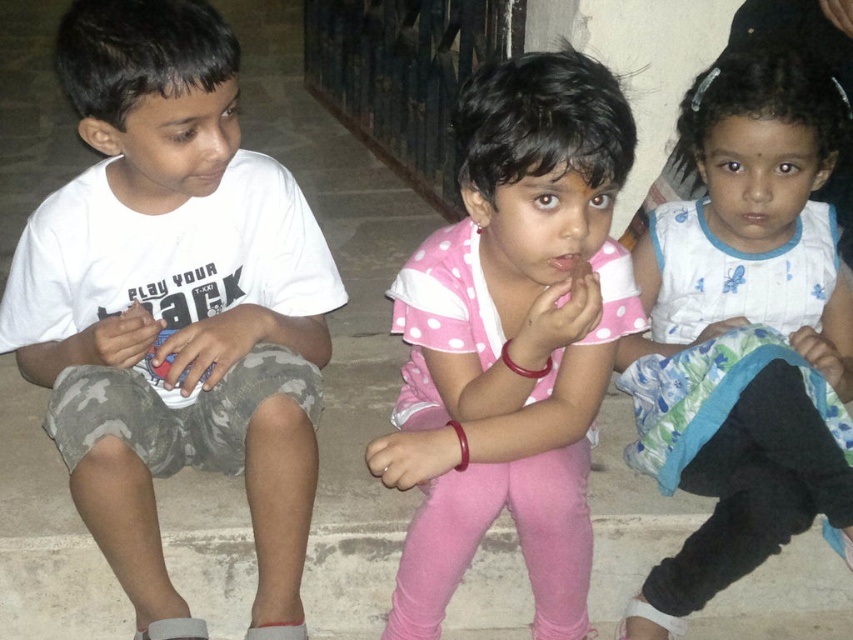
In the scene where three children are sitting on a stone floor at night, you see a white cotton shirt at left and a white dotted fabric at center. Which of these two items is positioned further to the left?

The white cotton shirt at left is positioned further to the left compared to the white dotted fabric at center.

You are a photographer setting up a camera at a distance of 1 meter from the two children. The white cotton shirt at left and white dotted fabric at center are part of their clothing. Can you focus on both subjects simultaneously if your camera has a depth of field that can cover 80 centimeters?

The white cotton shirt at left and white dotted fabric at center are 79.18 centimeters apart, so yes, the camera can focus on both subjects simultaneously since the distance between them is within the 80 centimeter depth of field.

You are a photographer setting up a tripod at point 0.5, 0.5. You need to capture a photo of the white cotton shirt at left without any obstruction. Is the shirt within your camera frame? Please explain why or why not.

The white cotton shirt at left is located at point (173,305). The tripod is set up at point (426,320). Since the shirt is positioned closer to the lower left area compared to the tripod, it should be within the camera frame unless there are obstructions not mentioned. However, the scene description mentions three children sitting closely together, so there might be other children blocking the view. The answer requires more information about the exact positions and sizes of the children to determine if the